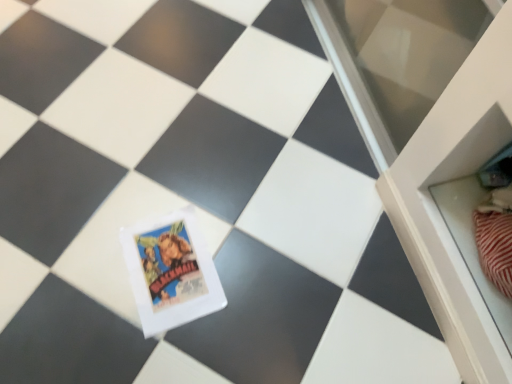
Identify the location of matte paper comic book at center. Image resolution: width=512 pixels, height=384 pixels. (170, 272).

Describe the element at coordinates (170, 272) in the screenshot. The height and width of the screenshot is (384, 512). I see `matte paper comic book at center` at that location.

This screenshot has width=512, height=384. Identify the location of matte paper comic book at center. (170, 272).